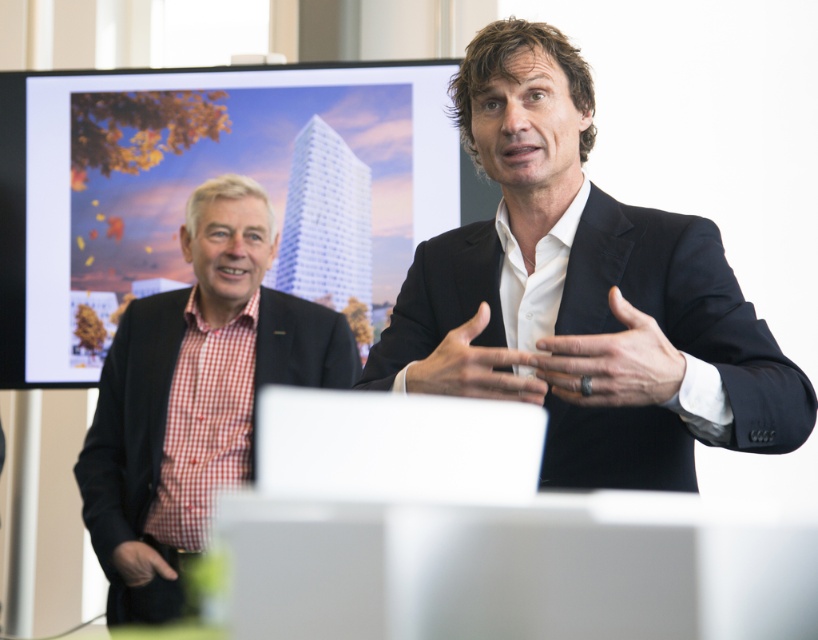
Looking at this image, you are attending a meeting and need to present a report. You see the red checkered shirt at left and the black leather hand at center. Which object is located more to the left?

The red checkered shirt at left is positioned on the left side of the black leather hand at center, so it is more to the left.

You are an event planner setting up for a presentation. You need to ensure that the matte digital display at upper left and the black matte hand at lower left are visible to all attendees. Given their sizes, which object should you place closer to the front of the room to ensure visibility?

The matte digital display at upper left is taller than the black matte hand at lower left. To ensure visibility for all attendees, you should place the taller matte digital display at upper left closer to the front of the room so that it can be seen more easily over any potential obstructions.